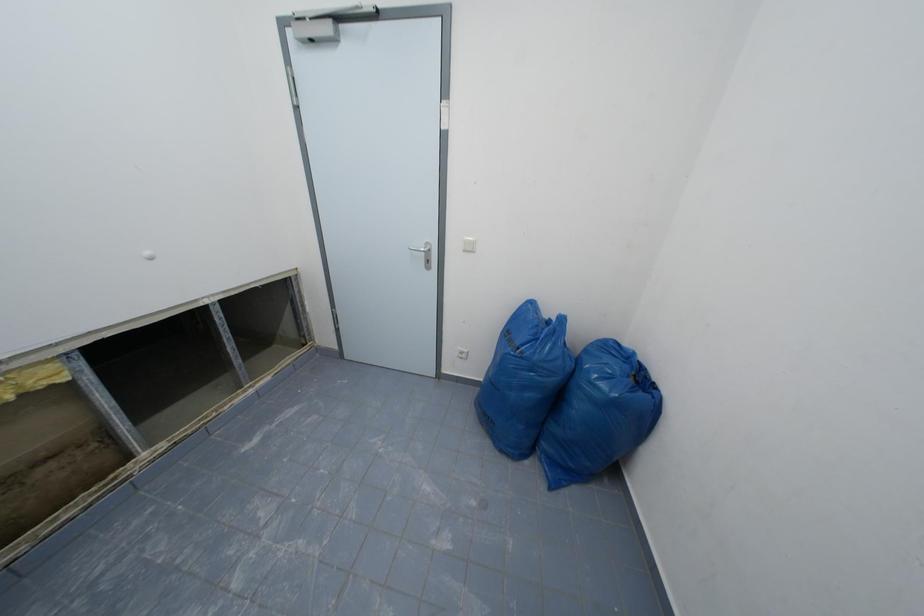
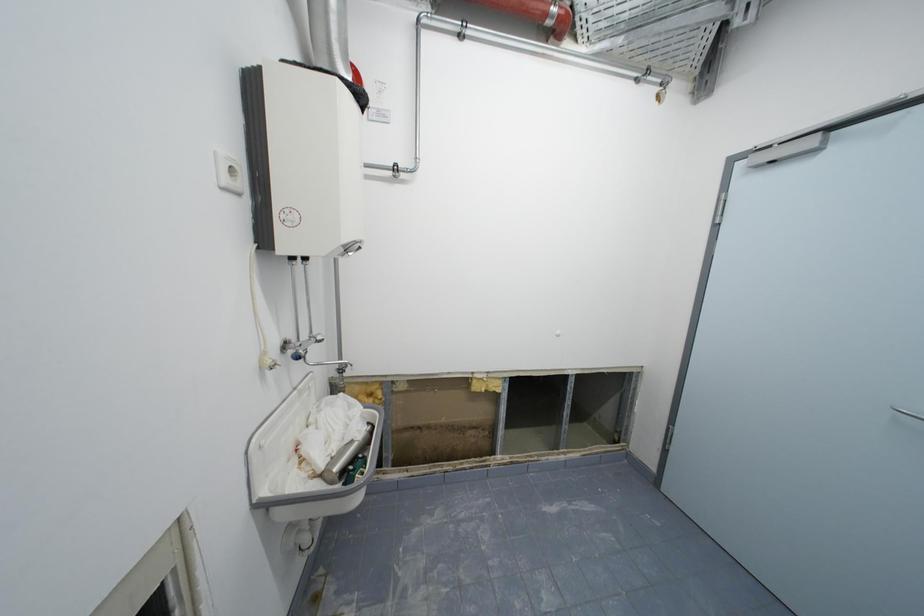
Question: The camera is either moving clockwise (left) or counter-clockwise (right) around the object. The first image is from the beginning of the video and the second image is from the end. Is the camera moving left or right when shooting the video?

Choices:
 (A) Left
 (B) Right

Answer: (B)